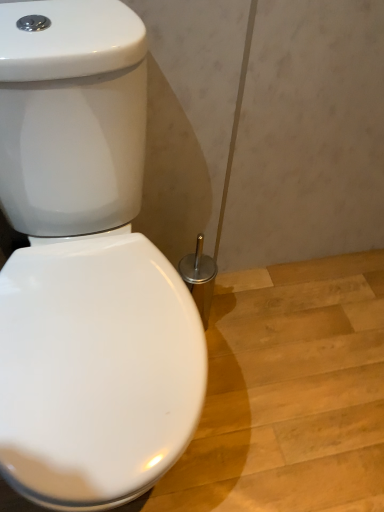
This screenshot has height=512, width=384. Describe the element at coordinates (96, 370) in the screenshot. I see `white glossy bidet at lower left` at that location.

Identify the location of white glossy bidet at lower left. This screenshot has height=512, width=384. (96, 370).

The height and width of the screenshot is (512, 384). What are the coordinates of `white glossy bidet at lower left` in the screenshot? It's located at tap(96, 370).